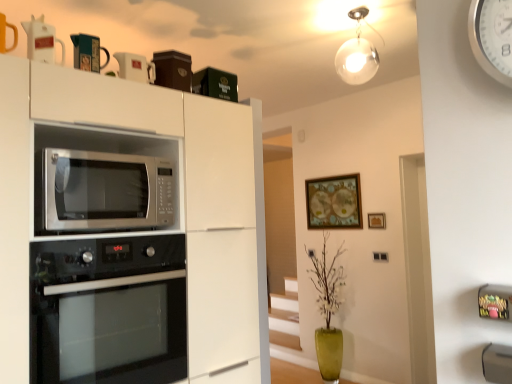
Question: Should I look upward or downward to see black glass oven at lower left?

Choices:
 (A) down
 (B) up

Answer: (A)

Question: Is white glossy pitcher at upper left, the first appliance when ordered from front to back, facing towards white plastic clock at upper right?

Choices:
 (A) yes
 (B) no

Answer: (B)

Question: Are white glossy pitcher at upper left, which ranks as the 3th appliance in back-to-front order, and white plastic clock at upper right making contact?

Choices:
 (A) no
 (B) yes

Answer: (A)

Question: Can you confirm if white glossy pitcher at upper left, the first appliance when ordered from front to back, is wider than white plastic clock at upper right?

Choices:
 (A) yes
 (B) no

Answer: (A)

Question: Is white glossy pitcher at upper left, the first appliance when ordered from front to back, facing away from white plastic clock at upper right?

Choices:
 (A) yes
 (B) no

Answer: (B)

Question: From a real-world perspective, is white glossy pitcher at upper left, which ranks as the 3th appliance in back-to-front order, beneath white plastic clock at upper right?

Choices:
 (A) yes
 (B) no

Answer: (B)

Question: Is matte black mug at upper center, which appears as the 2th appliance when viewed from the back, behind wooden framed map at upper center, which is the first picture frame from left to right?

Choices:
 (A) no
 (B) yes

Answer: (A)

Question: Does matte black mug at upper center, arranged as the 2th appliance when viewed from the front, have a smaller size compared to wooden framed map at upper center, the 2th picture frame positioned from the front?

Choices:
 (A) yes
 (B) no

Answer: (A)

Question: Is matte black mug at upper center, arranged as the 2th appliance when viewed from the front, facing away from wooden framed map at upper center, placed as the 1th picture frame when sorted from back to front?

Choices:
 (A) yes
 (B) no

Answer: (B)

Question: Considering the relative sizes of matte black mug at upper center, which appears as the 2th appliance when viewed from the back, and wooden framed map at upper center, which is the first picture frame from left to right, in the image provided, is matte black mug at upper center, which appears as the 2th appliance when viewed from the back, thinner than wooden framed map at upper center, which is the first picture frame from left to right,?

Choices:
 (A) yes
 (B) no

Answer: (B)

Question: Is matte black mug at upper center, arranged as the 2th appliance when viewed from the front, taller than wooden framed map at upper center, placed as the 1th picture frame when sorted from back to front?

Choices:
 (A) no
 (B) yes

Answer: (A)

Question: From a real-world perspective, is matte black mug at upper center, arranged as the 2th appliance when viewed from the front, located higher than wooden framed map at upper center, the 2th picture frame positioned from the front?

Choices:
 (A) yes
 (B) no

Answer: (A)

Question: Does black glass oven at lower left appear on the left side of white plastic clock at upper right?

Choices:
 (A) yes
 (B) no

Answer: (A)